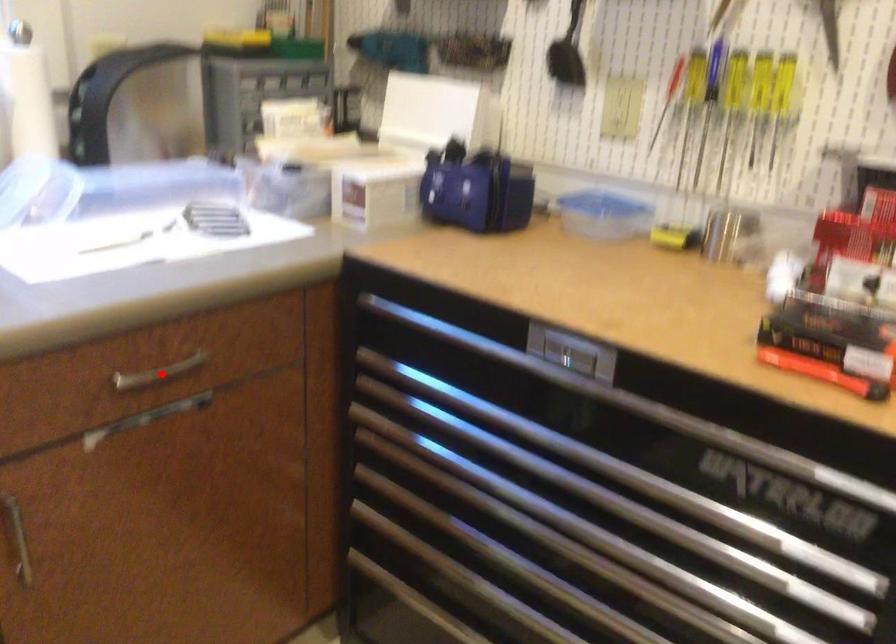
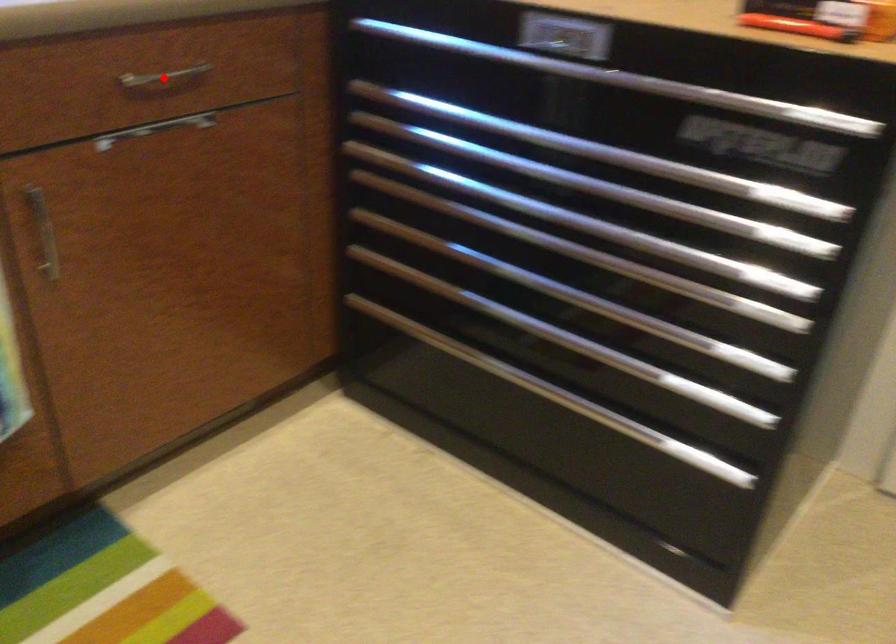
I am providing you with two images of the same scene from different viewpoints. A red point is marked on the first image and another point is marked on the second image. Are the points marked in image1 and image2 representing the same 3D position?

Yes